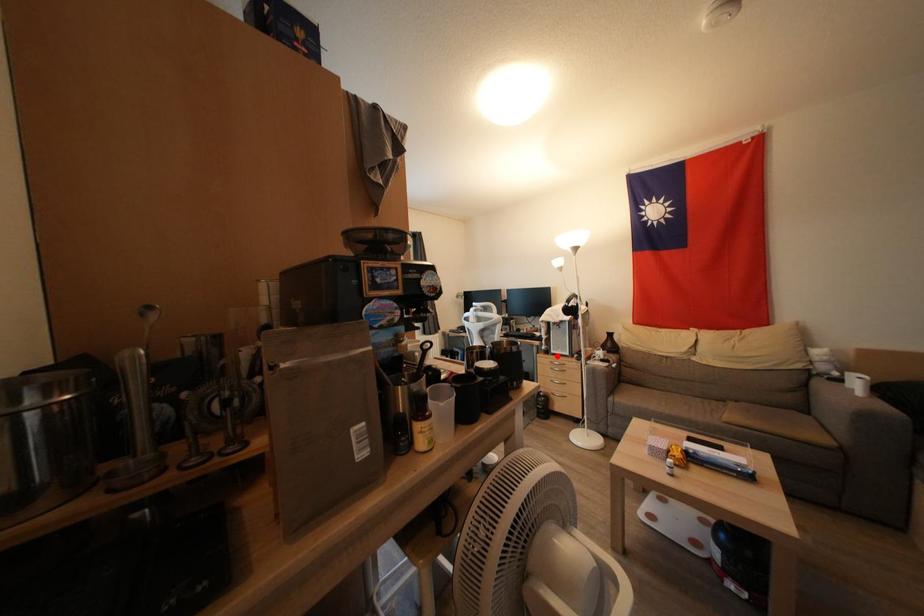
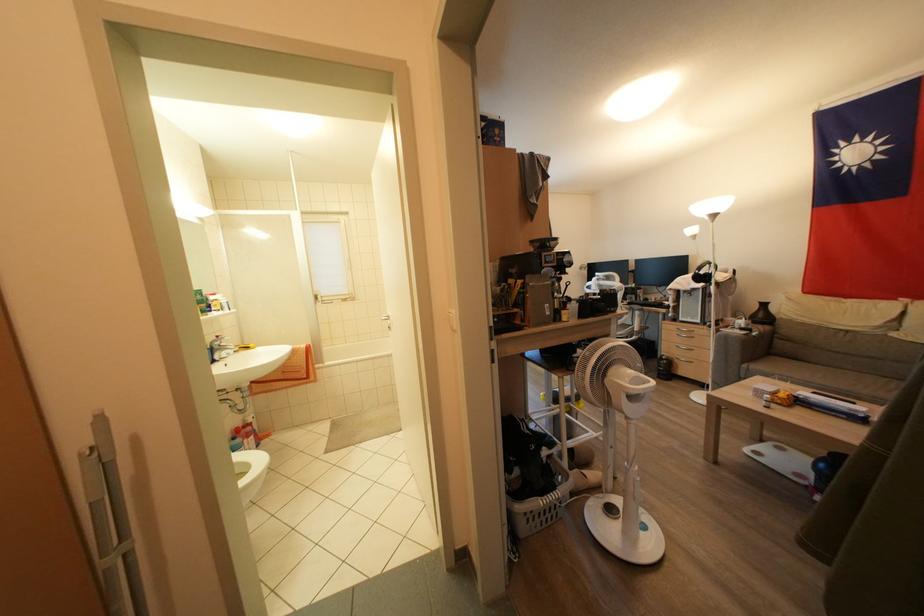
In the second image, find the point that corresponds to the highlighted location in the first image.

(686, 323)